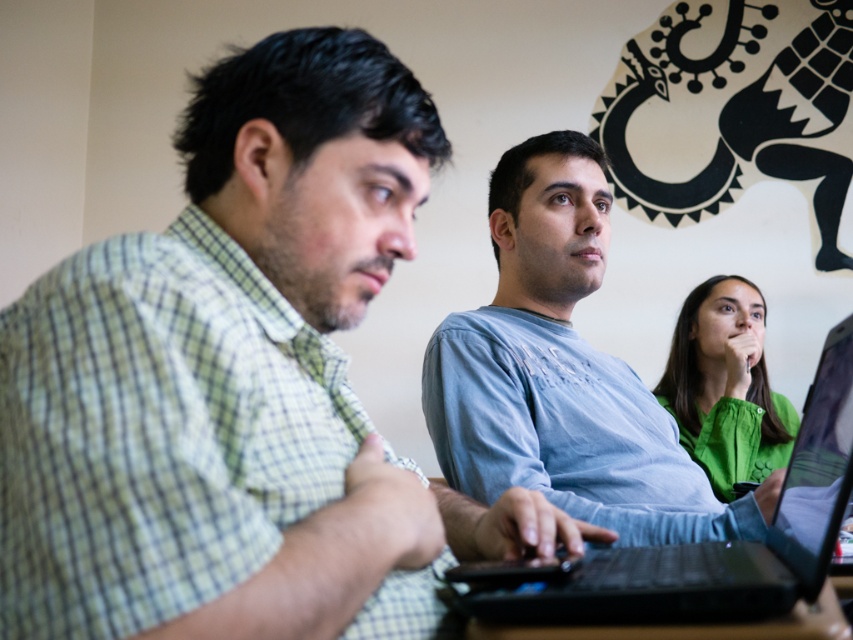
You are a person sitting at the table and want to place a coffee mug on the black plastic table at lower center. However, there is a black matte laptop at center in the way. Can you move the laptop to access the table?

The black plastic table at lower center is behind the black matte laptop at center, so you cannot directly access the table without moving the laptop first.

You are a delivery robot with a package that needs to be placed on the table. The package is 24 inches long. You see the black matte laptop at center. Can you place the package horizontally on the table without overlapping the laptop?

The distance between the black matte laptop at center and the camera is 24.46 inches. Since the package is 24 inches long, it can be placed horizontally on the table without overlapping the laptop as there is sufficient space.